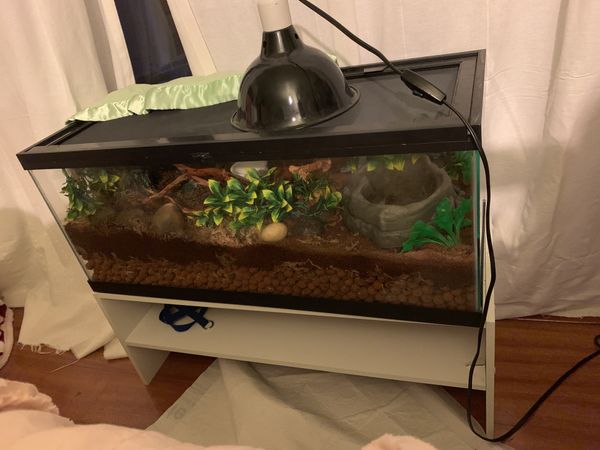
This screenshot has height=450, width=600. I want to click on satin blanket, so click(173, 98).